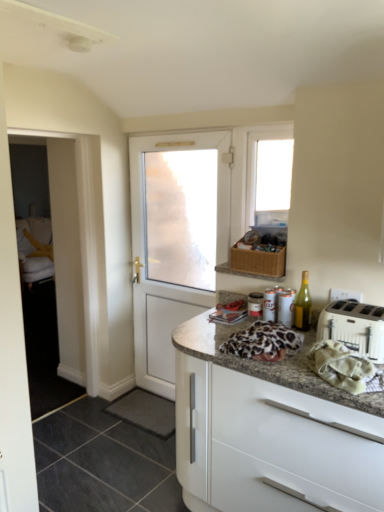
You are a GUI agent. You are given a task and a screenshot of the screen. Output one action in this format:
    pyautogui.click(x=<x>, y=<y>)
    Task: Click on the empty space that is to the right of white glossy screen door at left
    The image size is (384, 512).
    Given the screenshot: What is the action you would take?
    pyautogui.click(x=105, y=414)